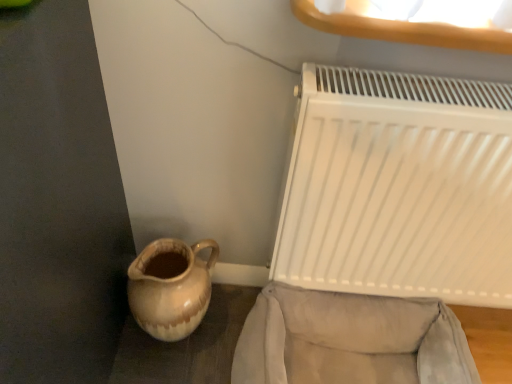
Measure the distance between point [425,382] and camera.

They are 1.08 meters apart.

In order to face velvet beige armchair at lower right, should I rotate leftwards or rightwards?

You should look right and rotate roughly 13.239 degrees.

What is the approximate width of brown glazed jug at lower left?

brown glazed jug at lower left is 20.37 centimeters wide.

What is the approximate height of brown glazed jug at lower left?

12.13 inches.

Image resolution: width=512 pixels, height=384 pixels. I want to click on velvet beige armchair at lower right, so click(x=350, y=340).

Can you tell me how much velvet beige armchair at lower right and brown glazed jug at lower left differ in facing direction?

0.000596 degrees.

From the image's perspective, is velvet beige armchair at lower right below brown glazed jug at lower left?

Yes, from the image's perspective, velvet beige armchair at lower right is beneath brown glazed jug at lower left.

Is velvet beige armchair at lower right facing towards brown glazed jug at lower left?

No.

From a real-world perspective, relative to brown glazed jug at lower left, is velvet beige armchair at lower right vertically above or below?

velvet beige armchair at lower right is situated lower than brown glazed jug at lower left in the real world.

Does brown glazed jug at lower left have a greater width compared to white matte radiator at right?

Yes, brown glazed jug at lower left is wider than white matte radiator at right.

From the picture: From a real-world perspective, is brown glazed jug at lower left on white matte radiator at right?

Actually, brown glazed jug at lower left is physically below white matte radiator at right in the real world.

Locate an element on the screen. This screenshot has width=512, height=384. jug on the left of white matte radiator at right is located at coordinates (170, 290).

From the picture: Which point is more distant from viewer, (176, 322) or (324, 145)?

The point (176, 322) is farther.

Is white matte radiator at right inside velvet beige armchair at lower right?

No, white matte radiator at right is located outside of velvet beige armchair at lower right.

Is velvet beige armchair at lower right oriented away from white matte radiator at right?

That's not correct — velvet beige armchair at lower right is not looking away from white matte radiator at right.

From a real-world perspective, between velvet beige armchair at lower right and white matte radiator at right, who is vertically lower?

From a 3D spatial view, velvet beige armchair at lower right is below.

Between point (445, 84) and point (207, 287), which one is positioned in front?

The point (445, 84) is more forward.

Is white matte radiator at right directly adjacent to brown glazed jug at lower left?

They are not placed beside each other.

In the scene shown: Does white matte radiator at right have a greater width compared to brown glazed jug at lower left?

Incorrect, the width of white matte radiator at right does not surpass that of brown glazed jug at lower left.

Where is `armchair below the white matte radiator at right (from the image's perspective)`? The height and width of the screenshot is (384, 512). armchair below the white matte radiator at right (from the image's perspective) is located at coordinates (350, 340).

Which object is positioned more to the right, white matte radiator at right or velvet beige armchair at lower right?

white matte radiator at right is more to the right.

From a real-world perspective, does white matte radiator at right stand above velvet beige armchair at lower right?

Indeed, from a real-world perspective, white matte radiator at right stands above velvet beige armchair at lower right.

Looking at the image, does white matte radiator at right seem bigger or smaller compared to velvet beige armchair at lower right?

Clearly, white matte radiator at right is smaller in size than velvet beige armchair at lower right.

From a real-world perspective, between brown glazed jug at lower left and velvet beige armchair at lower right, who is vertically lower?

velvet beige armchair at lower right.

Is velvet beige armchair at lower right at the back of brown glazed jug at lower left?

brown glazed jug at lower left is not turned away from velvet beige armchair at lower right.

Is brown glazed jug at lower left not near velvet beige armchair at lower right?

No, brown glazed jug at lower left is not far away from velvet beige armchair at lower right.

From their relative heights in the image, would you say brown glazed jug at lower left is taller or shorter than velvet beige armchair at lower right?

brown glazed jug at lower left is taller than velvet beige armchair at lower right.

This screenshot has height=384, width=512. Find the location of `jug positioned vertically above the velvet beige armchair at lower right (from a real-world perspective)`. jug positioned vertically above the velvet beige armchair at lower right (from a real-world perspective) is located at coordinates (170, 290).

The width and height of the screenshot is (512, 384). What are the coordinates of `jug that is below the white matte radiator at right (from the image's perspective)` in the screenshot? It's located at (170, 290).

Considering their positions, is brown glazed jug at lower left positioned closer to white matte radiator at right than velvet beige armchair at lower right?

velvet beige armchair at lower right is positioned closer to the anchor white matte radiator at right.

Considering their positions, is velvet beige armchair at lower right positioned further to white matte radiator at right than brown glazed jug at lower left?

The object further to white matte radiator at right is brown glazed jug at lower left.

Considering their positions, is velvet beige armchair at lower right positioned further to brown glazed jug at lower left than white matte radiator at right?

white matte radiator at right lies further to brown glazed jug at lower left than the other object.

Which object lies nearer to the anchor point brown glazed jug at lower left, white matte radiator at right or velvet beige armchair at lower right?

The object closer to brown glazed jug at lower left is velvet beige armchair at lower right.

Considering their positions, is brown glazed jug at lower left positioned closer to velvet beige armchair at lower right than white matte radiator at right?

white matte radiator at right is positioned closer to the anchor velvet beige armchair at lower right.

From the image, which object appears to be nearer to velvet beige armchair at lower right, white matte radiator at right or brown glazed jug at lower left?

white matte radiator at right.

The height and width of the screenshot is (384, 512). Find the location of `armchair located between brown glazed jug at lower left and white matte radiator at right in the left-right direction`. armchair located between brown glazed jug at lower left and white matte radiator at right in the left-right direction is located at coordinates (350, 340).